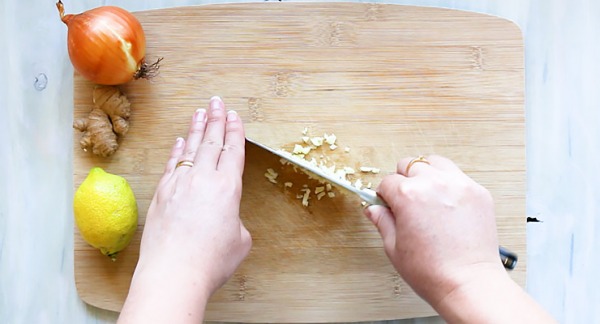
Image resolution: width=600 pixels, height=324 pixels. I want to click on blue spot on table, so click(36, 88).